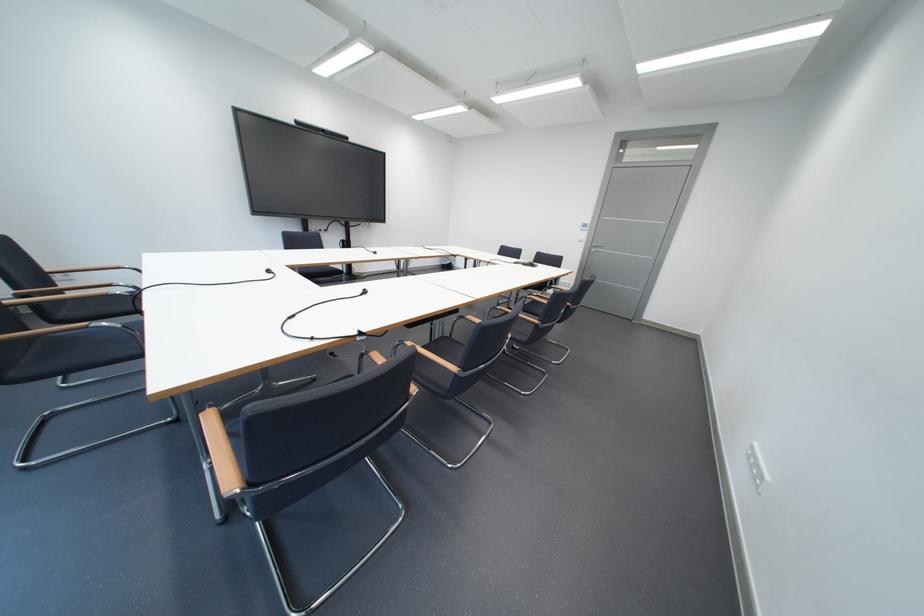
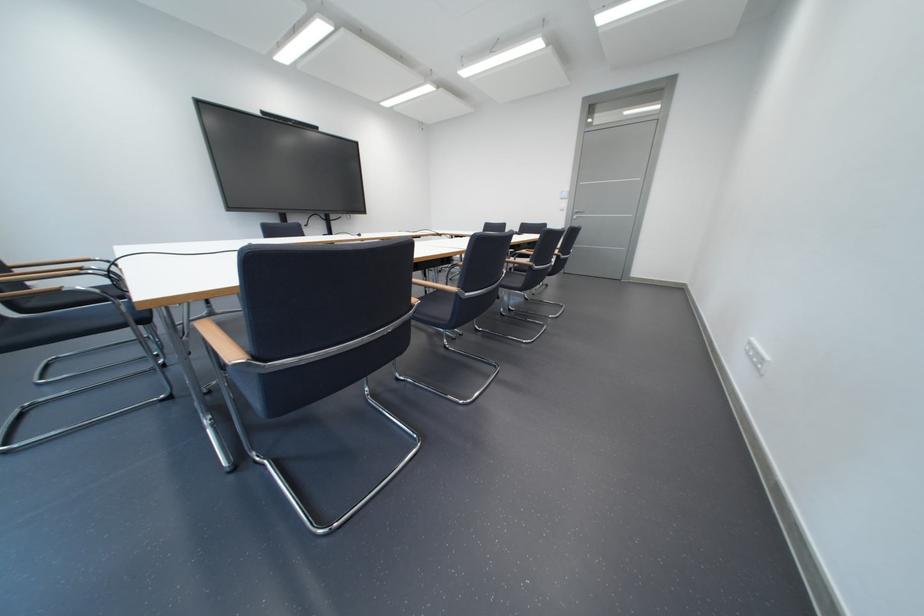
Question: Based on the continuous images, in which direction is the camera rotating? Reply with the corresponding letter.

Choices:
 (A) Left
 (B) Right
 (C) Up
 (D) Down

Answer: (B)